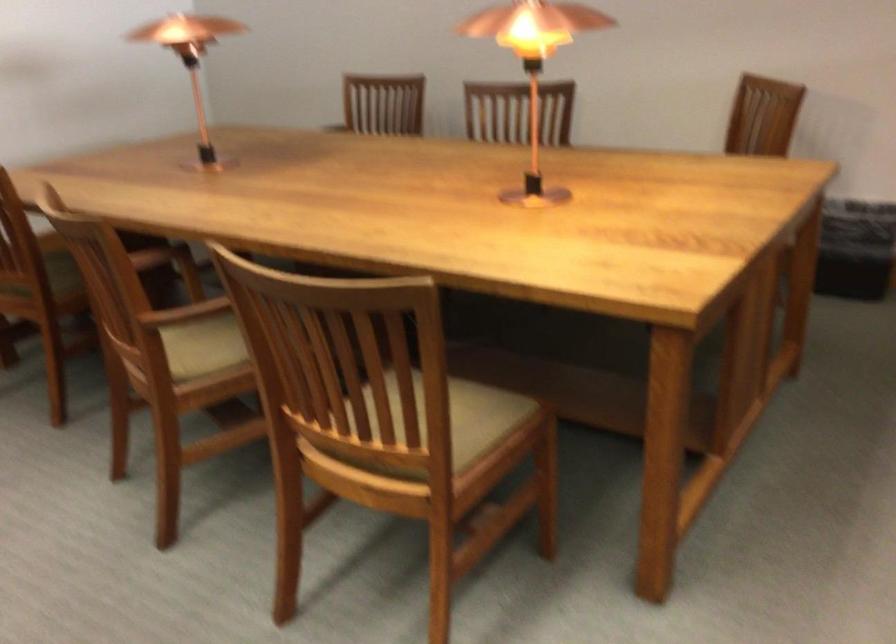
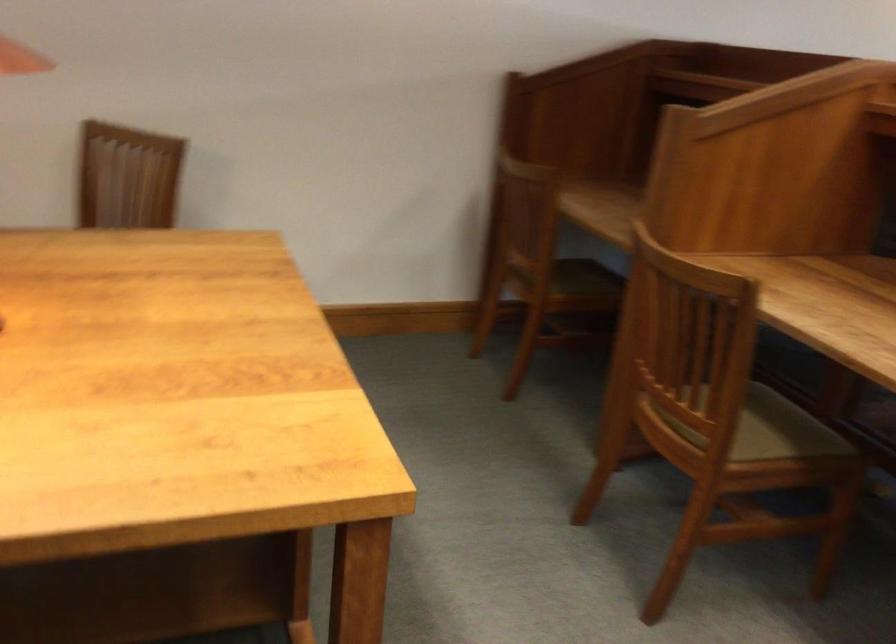
Question: Based on the continuous images, in which direction is the camera rotating? Reply with the corresponding letter.

Choices:
 (A) Left
 (B) Right
 (C) Up
 (D) Down

Answer: (B)